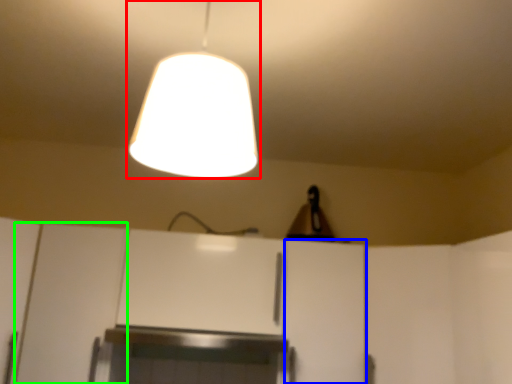
Question: Which object is positioned closest to lamp (highlighted by a red box)? Select from cabinetry (highlighted by a blue box) and cabinetry (highlighted by a green box).

Choices:
 (A) cabinetry
 (B) cabinetry

Answer: (A)